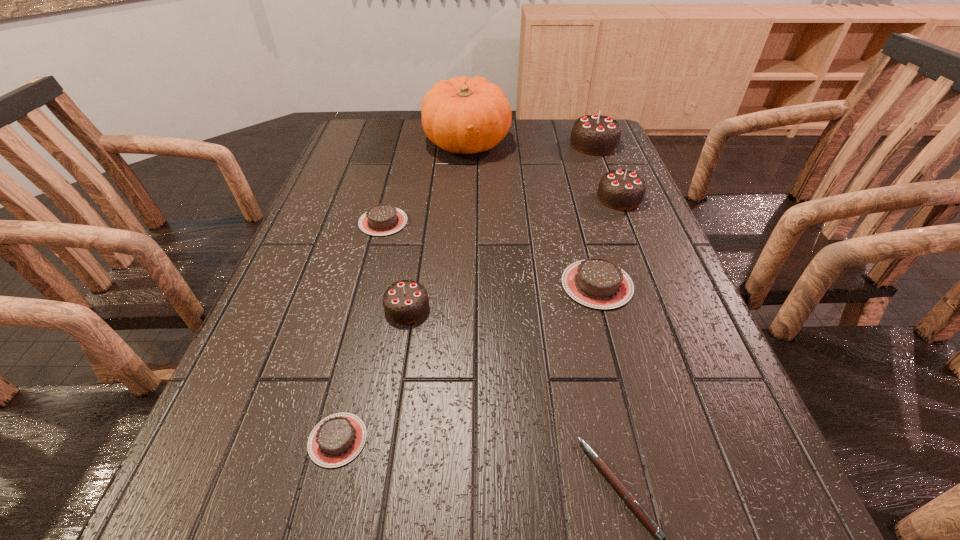
Find the location of `vacant area that lies between the pumpkin and the second smallest chocolate chocolate cake`. vacant area that lies between the pumpkin and the second smallest chocolate chocolate cake is located at coordinates (543, 170).

At what (x,y) coordinates should I click in order to perform the action: click on vacant area that lies between the tallest chocolate cake and the pumpkin. Please return your answer as a coordinate pair (x, y). The height and width of the screenshot is (540, 960). Looking at the image, I should click on (530, 144).

Where is `free spot between the biggest chocolate chocolate cake and the biggest brown chocolate cake`? This screenshot has width=960, height=540. free spot between the biggest chocolate chocolate cake and the biggest brown chocolate cake is located at coordinates (595, 214).

Identify the location of empty space between the fifth shortest object and the farthest chocolate cake. (500, 226).

At what (x,y) coordinates should I click in order to perform the action: click on object that is the second closest to the tallest object. Please return your answer as a coordinate pair (x, y). The width and height of the screenshot is (960, 540). Looking at the image, I should click on (382, 219).

Where is `object that can be found as the second closest to the orange pumpkin`? The height and width of the screenshot is (540, 960). object that can be found as the second closest to the orange pumpkin is located at coordinates (382, 219).

Identify the location of chocolate cake that can be found as the closest to the farthest chocolate chocolate cake. (620, 189).

Choose which chocolate cake is the fourth nearest neighbor to the smallest chocolate chocolate cake. Please provide its 2D coordinates. Your answer should be formatted as a tuple, i.e. [(x, y)], where the tuple contains the x and y coordinates of a point satisfying the conditions above.

[(620, 189)]

Locate an element on the screen. the third closest chocolate chocolate cake to the tallest object is located at coordinates (406, 301).

This screenshot has width=960, height=540. Identify the location of chocolate chocolate cake that is the closest one to the farthest chocolate chocolate cake. (620, 189).